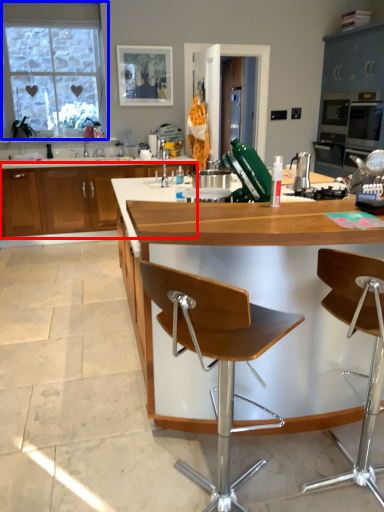
Question: Which point is further to the camera, cabinetry (highlighted by a red box) or window (highlighted by a blue box)?

Choices:
 (A) cabinetry
 (B) window

Answer: (B)